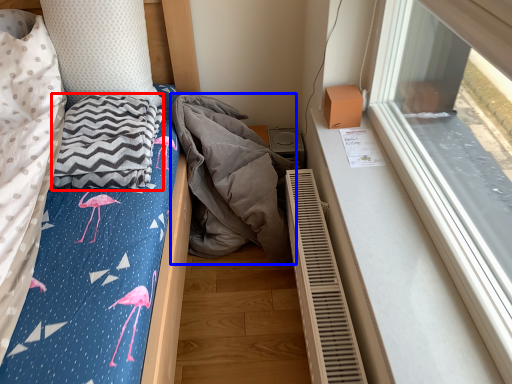
Question: Which object appears farthest to the camera in this image, blanket (highlighted by a red box) or material (highlighted by a blue box)?

Choices:
 (A) blanket
 (B) material

Answer: (B)